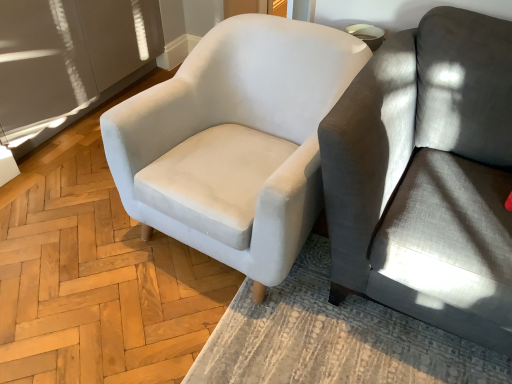
Locate an element on the screen. This screenshot has height=384, width=512. free space in front of white fabric chair at center is located at coordinates (203, 336).